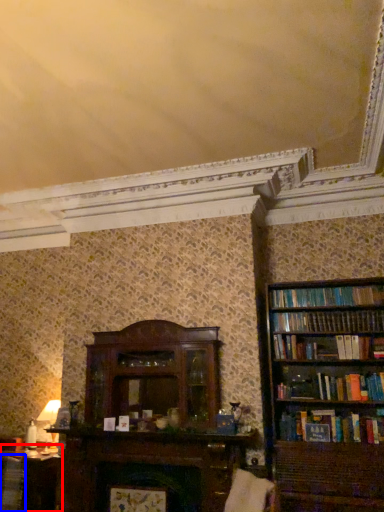
Question: Which object is further to the camera taking this photo, table (highlighted by a red box) or book (highlighted by a blue box)?

Choices:
 (A) table
 (B) book

Answer: (A)